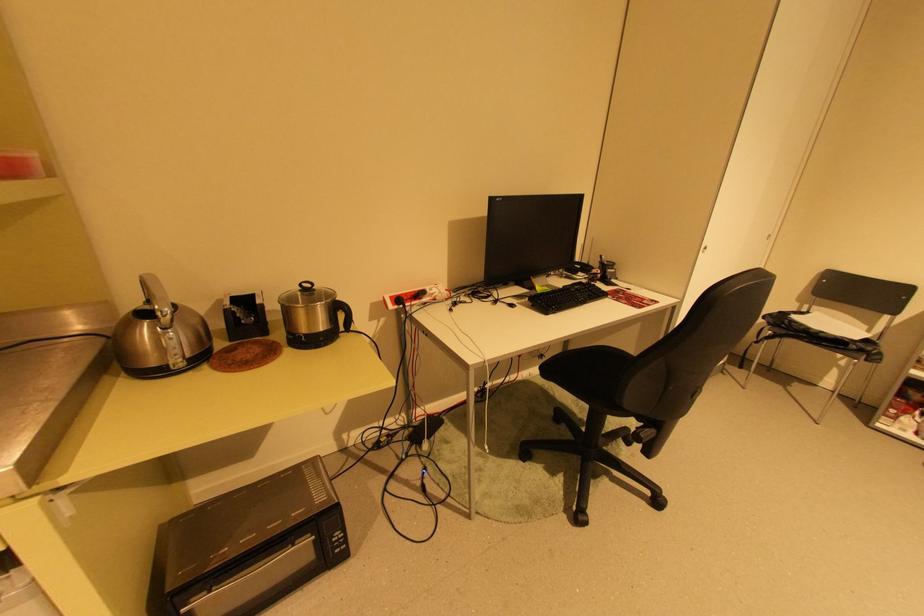
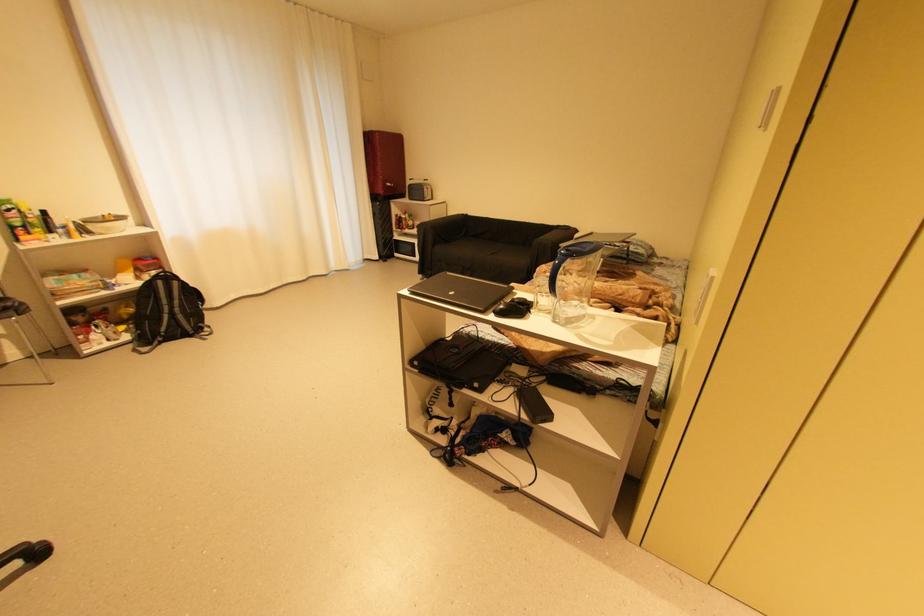
The images are taken continuously from a first-person perspective. In which direction is your viewpoint rotating?

The camera's rotation is toward right-down.